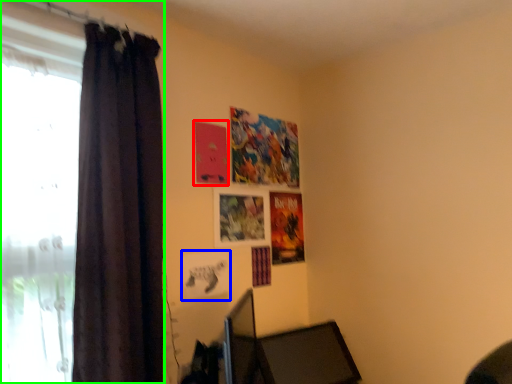
Question: Based on their relative distances, which object is nearer to poster page (highlighted by a red box)? Choose from picture frame (highlighted by a blue box) and curtain (highlighted by a green box).

Choices:
 (A) picture frame
 (B) curtain

Answer: (A)